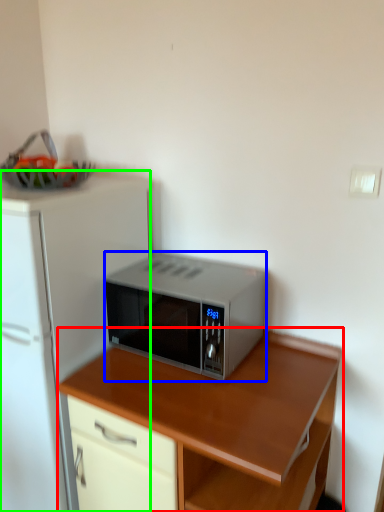
Question: Based on their relative distances, which object is nearer to desk (highlighted by a red box)? Choose from microwave oven (highlighted by a blue box) and refrigerator (highlighted by a green box).

Choices:
 (A) microwave oven
 (B) refrigerator

Answer: (A)